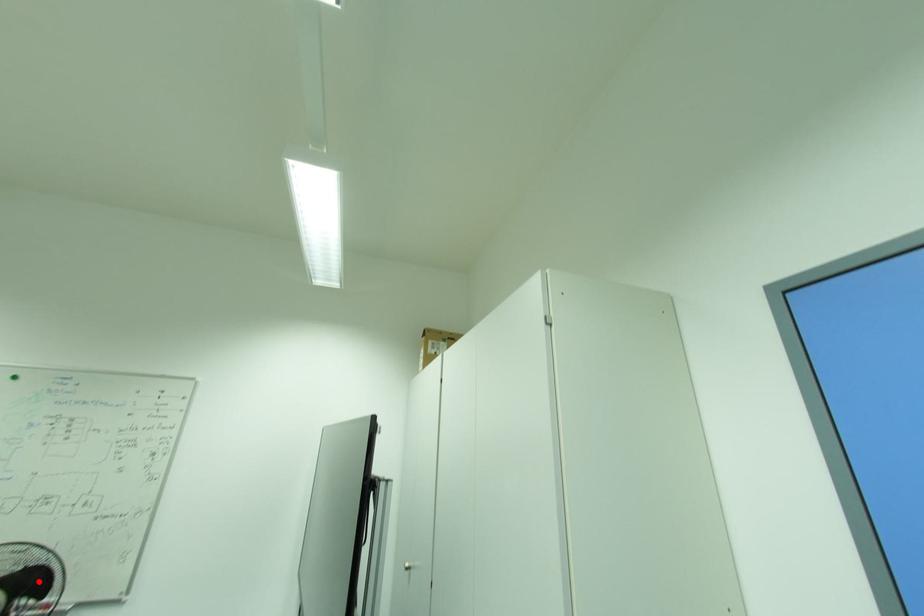
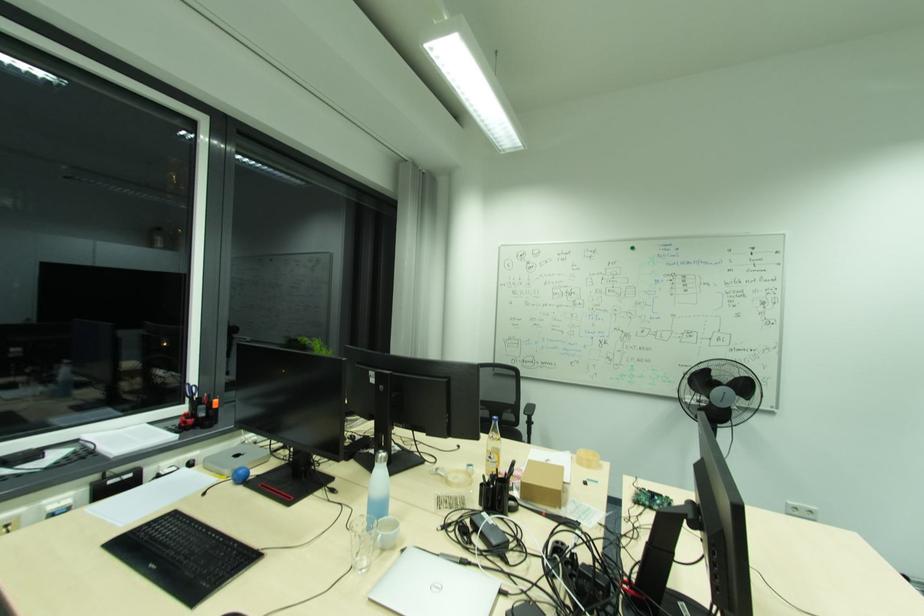
Question: A red point is marked in image1. In image2, is the corresponding 3D point closer to the camera or farther? Reply with the corresponding letter.

Choices:
 (A) The corresponding 3D point is closer.
 (B) The corresponding 3D point is farther.

Answer: (B)